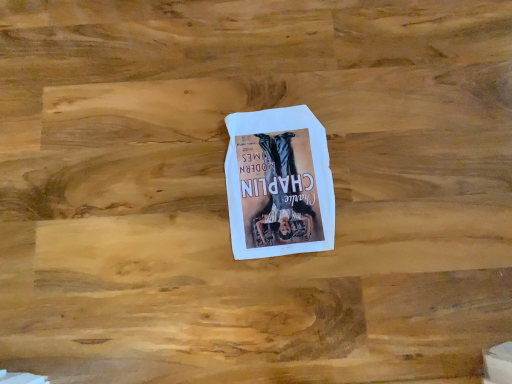
Where is `white paper at center`? The image size is (512, 384). white paper at center is located at coordinates (279, 183).

The width and height of the screenshot is (512, 384). What do you see at coordinates (279, 183) in the screenshot?
I see `white paper at center` at bounding box center [279, 183].

This screenshot has width=512, height=384. In order to click on white paper at center in this screenshot , I will do `click(279, 183)`.